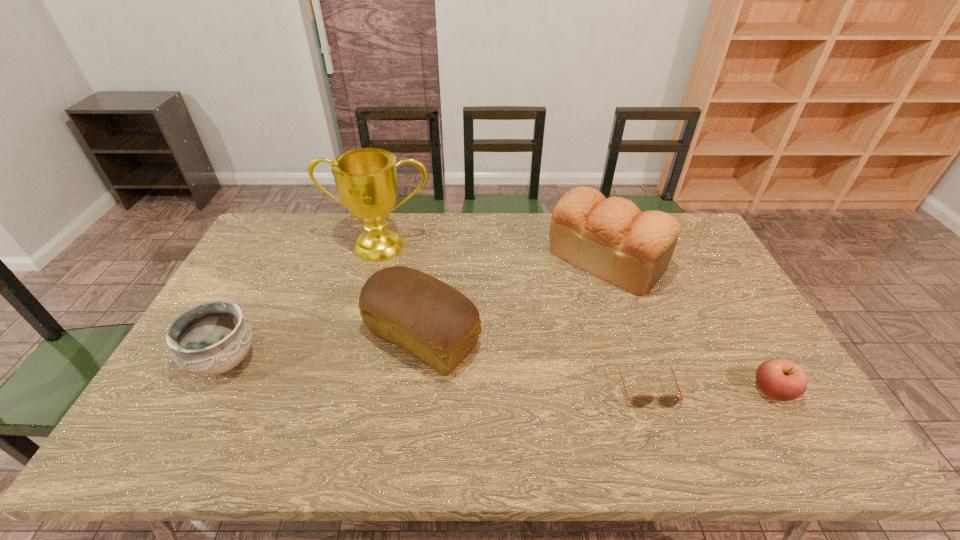
Find the location of a particular element. This screenshot has width=960, height=540. blank space located on the shiny surface of the tallest object is located at coordinates (365, 305).

The width and height of the screenshot is (960, 540). I want to click on free space located on the front of the fifth shortest object, so click(x=635, y=349).

Where is `vacant space located 0.140m on the left of the left bread`? vacant space located 0.140m on the left of the left bread is located at coordinates (313, 339).

At what (x,y) coordinates should I click in order to perform the action: click on vacant space located 0.300m on the right of the leftmost object. Please return your answer as a coordinate pair (x, y). Image resolution: width=960 pixels, height=540 pixels. Looking at the image, I should click on (372, 361).

Identify the location of vacant space located on the left of the rightmost object. [653, 392].

This screenshot has width=960, height=540. Identify the location of free space located on the front-facing side of the shortest object. (x=668, y=455).

You are a GUI agent. You are given a task and a screenshot of the screen. Output one action in this format:
    pyautogui.click(x=<x>, y=<y>)
    Task: Click on the award that is at the far edge
    This screenshot has height=540, width=960.
    Given the screenshot: What is the action you would take?
    pyautogui.click(x=366, y=180)

Where is `bread located in the far edge section of the desktop`? The width and height of the screenshot is (960, 540). bread located in the far edge section of the desktop is located at coordinates (611, 238).

The width and height of the screenshot is (960, 540). Find the location of `object positioned at the left edge`. object positioned at the left edge is located at coordinates (212, 338).

This screenshot has height=540, width=960. Find the location of `object that is at the right edge`. object that is at the right edge is located at coordinates (782, 380).